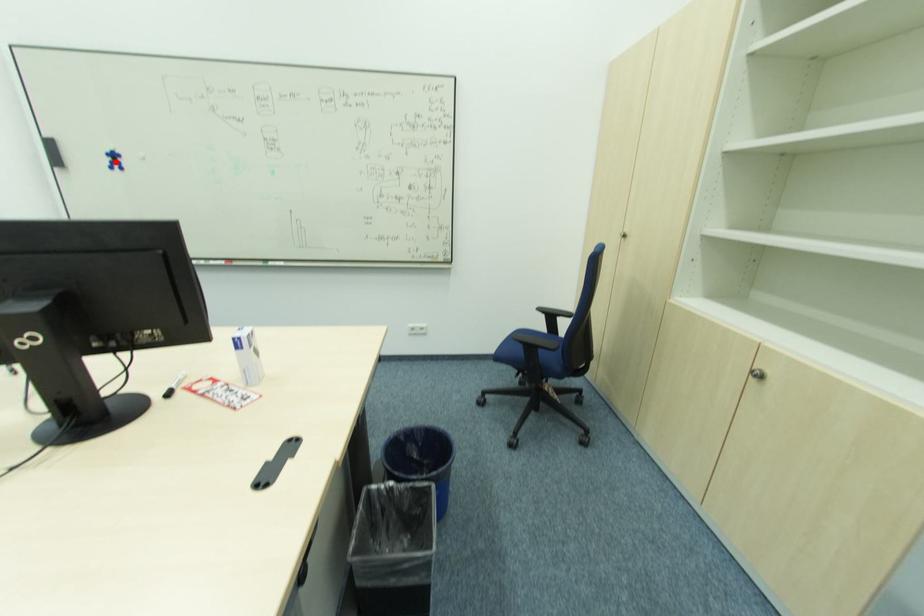
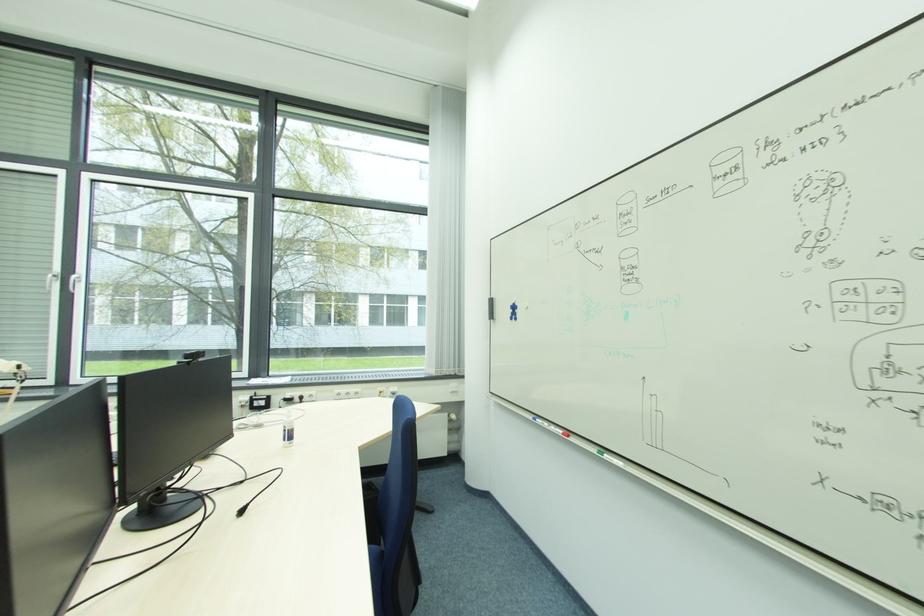
Find the pixel in the second image that matches the highlighted location in the first image.

(515, 313)